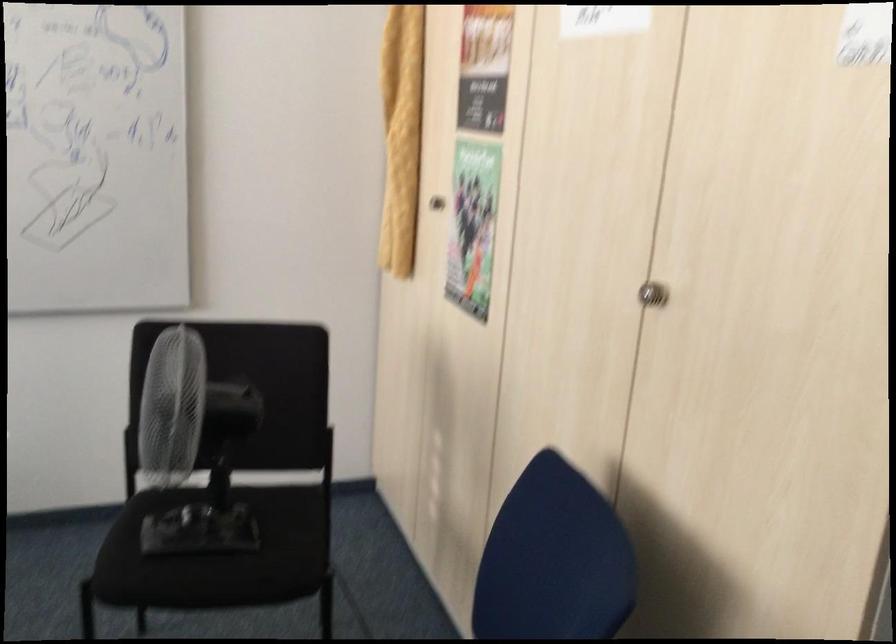
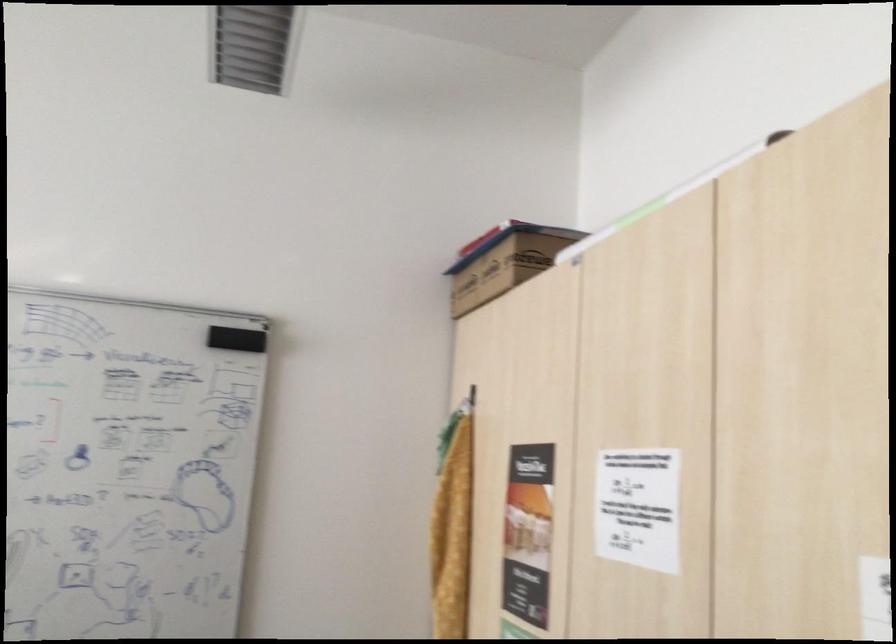
Question: The images are taken continuously from a first-person perspective. In which direction are you moving?

Choices:
 (A) Left
 (B) Right
 (C) Forward
 (D) Backward

Answer: (D)